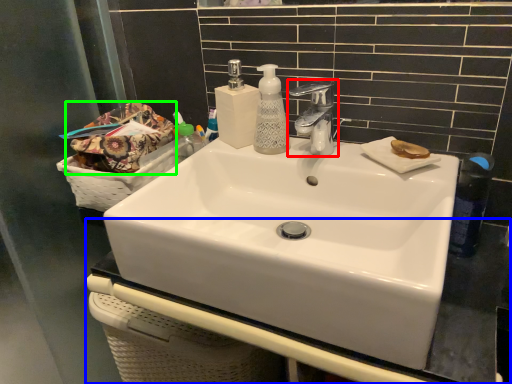
Question: Which object is positioned closest to tap (highlighted by a red box)? Select from counter top (highlighted by a blue box) and material (highlighted by a green box).

Choices:
 (A) counter top
 (B) material

Answer: (B)